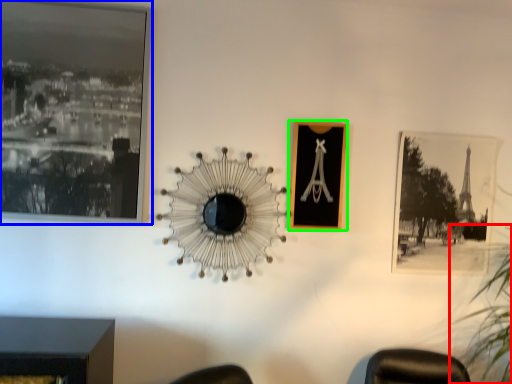
Question: Based on their relative distances, which object is farther from plant (highlighted by a red box)? Choose from picture frame (highlighted by a blue box) and picture frame (highlighted by a green box).

Choices:
 (A) picture frame
 (B) picture frame

Answer: (A)